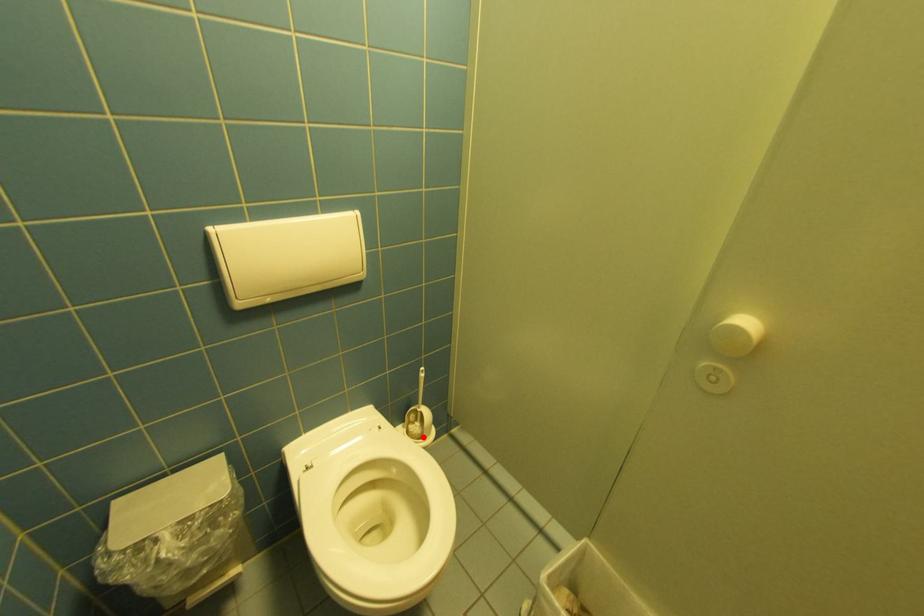
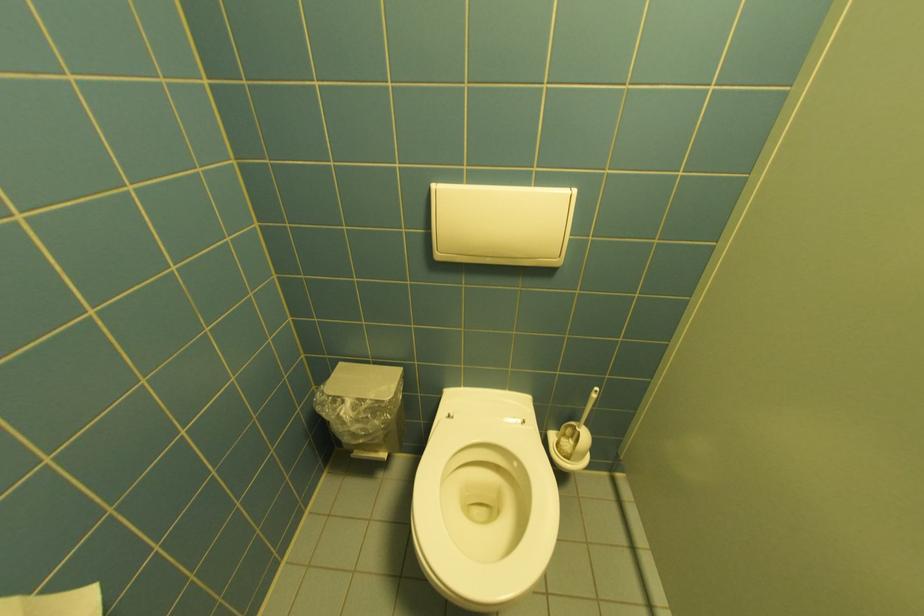
Locate, in the second image, the point that corresponds to the highlighted location in the first image.

(570, 455)